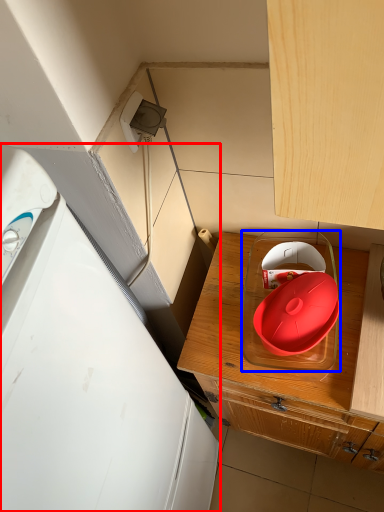
Question: Which of the following is the closest to the observer, home appliance (highlighted by a red box) or appliance (highlighted by a blue box)?

Choices:
 (A) home appliance
 (B) appliance

Answer: (A)